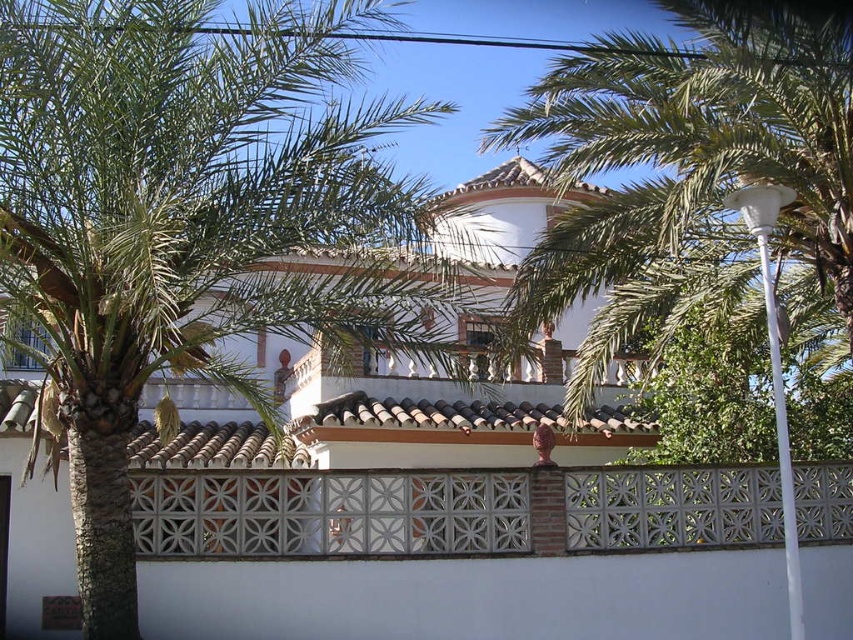
You are a landscape architect designing a garden path that needs to fit between the green leafy palm tree at left and the white textured tile fence at center. The path must be 2 meters wide. Can the space between them accommodate this width?

The green leafy palm tree at left is thinner than the white textured tile fence at center, but the description does not provide specific measurements of the distance between them. Without knowing the actual spacing, it is impossible to determine if the 2 meter wide path would fit.

You are standing in front of the Mediterranean house and want to take a photo of the decorative wall with the geometric pattern without the palm tree blocking the view. The camera you are using has a zoom lens that can focus on objects up to 10 meters away. Can you capture the decorative wall clearly without the green leafy palm tree at left appearing in the frame?

The green leafy palm tree at left is 9.60 meters away from the viewer. Since the camera can focus up to 10 meters, you can adjust the zoom to focus on the decorative wall while excluding the palm tree, as it is within the camera range. However, ensure the palm tree isn not in the frame by adjusting the angle or zoom level.

You are a gardener who needs to water both the green leafy palm tree at left and the white textured tile fence at center. Your watering can has a range of 5 meters. Can you water both objects without moving closer?

The distance between the green leafy palm tree at left and the white textured tile fence at center is 4.72 meters, which is within the watering can range of 5 meters. Therefore, you can water both objects without moving closer.